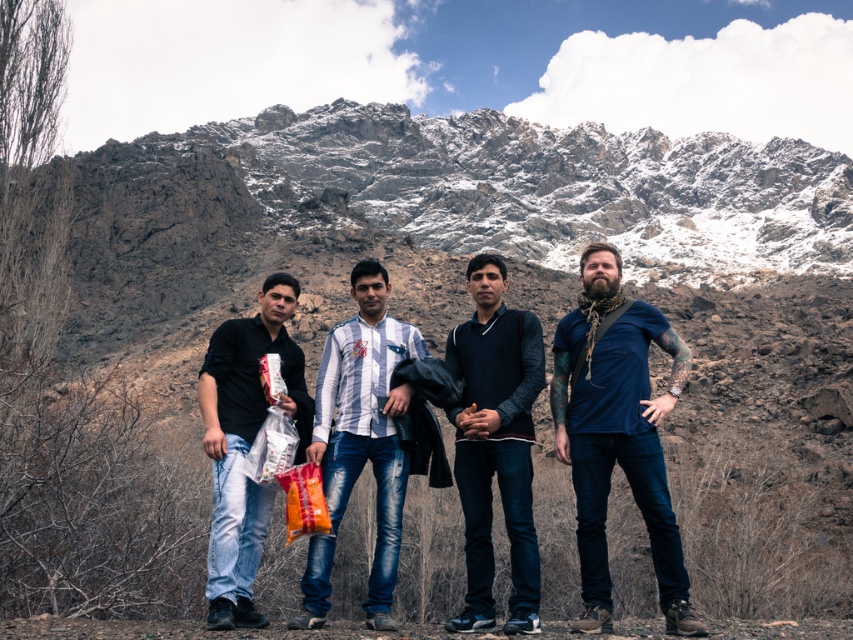
Does blue denim jeans at right have a smaller size compared to dark blue sweater at center?

Incorrect, blue denim jeans at right is not smaller in size than dark blue sweater at center.

Is point (582, 422) positioned before point (469, 467)?

Yes.

Between point (598, 458) and point (540, 372), which one is positioned behind?

The point (540, 372) is behind.

Where is `blue denim jeans at right`? blue denim jeans at right is located at coordinates (618, 436).

Does white striped shirt at center have a larger size compared to matte black shirt at left?

Incorrect, white striped shirt at center is not larger than matte black shirt at left.

Where is `white striped shirt at center`? Image resolution: width=853 pixels, height=640 pixels. white striped shirt at center is located at coordinates (360, 440).

The image size is (853, 640). I want to click on white striped shirt at center, so click(360, 440).

Consider the image. Is dark blue sweater at center thinner than white striped shirt at center?

Correct, dark blue sweater at center's width is less than white striped shirt at center's.

Who is more forward, [471,444] or [341,324]?

Positioned in front is point [471,444].

I want to click on dark blue sweater at center, so click(x=495, y=444).